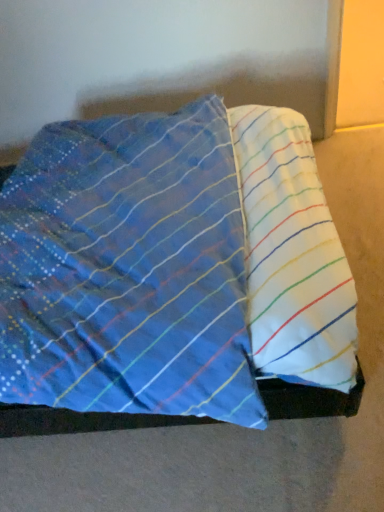
This screenshot has height=512, width=384. Describe the element at coordinates (170, 272) in the screenshot. I see `blue striped blanket at lower left` at that location.

Where is `blue striped blanket at lower left`? blue striped blanket at lower left is located at coordinates (170, 272).

Locate an element on the screen. The height and width of the screenshot is (512, 384). blue striped blanket at lower left is located at coordinates (170, 272).